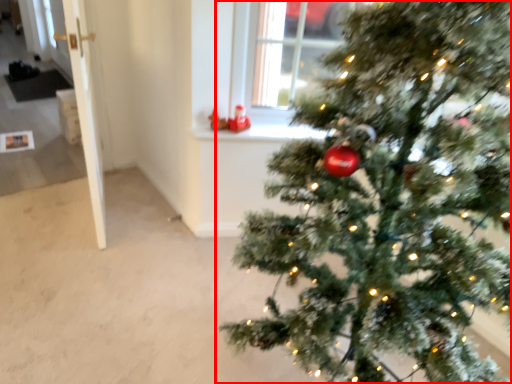
Question: Observing the image, what is the correct spatial positioning of christmas tree (annotated by the red box) in reference to window sill?

Choices:
 (A) left
 (B) right

Answer: (B)